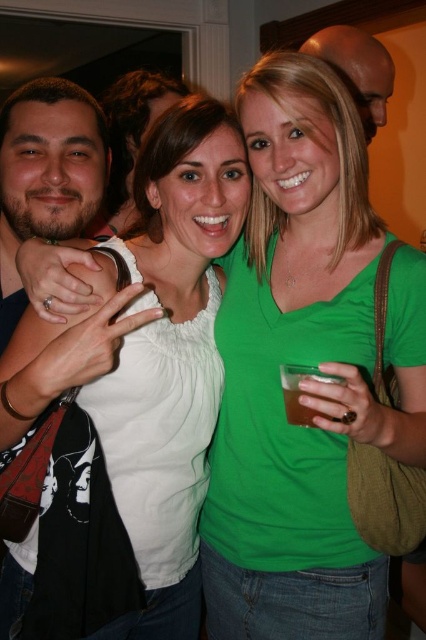
What are the coordinates of the green matte shirt at center in the image?

The green matte shirt at center is located at coordinates (307, 364).

In the scene shown: You are at a party and want to greet both people wearing the green matte shirt at center and the white matte shirt at center. Which one should you approach first if you want to greet the person closest to you?

You should approach the green matte shirt at center first because it is in front of the white matte shirt at center, meaning it is closer to you.